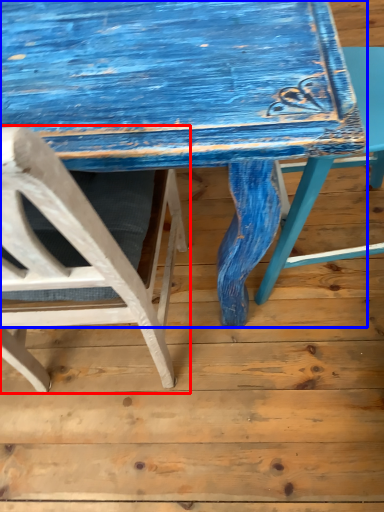
Question: Among these objects, which one is farthest to the camera, chair (highlighted by a red box) or table (highlighted by a blue box)?

Choices:
 (A) chair
 (B) table

Answer: (B)